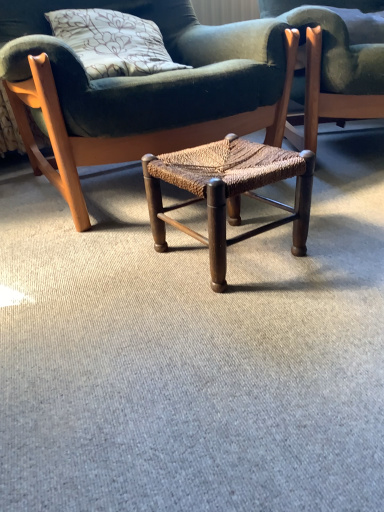
Question: From the image's perspective, is velvet floral pillow at upper left over woven wood stool at center, the second chair from the right?

Choices:
 (A) yes
 (B) no

Answer: (A)

Question: Is the depth of velvet floral pillow at upper left less than that of woven wood stool at center, the second chair from the right?

Choices:
 (A) no
 (B) yes

Answer: (A)

Question: Does velvet floral pillow at upper left touch woven wood stool at center, the first chair viewed from the left?

Choices:
 (A) yes
 (B) no

Answer: (B)

Question: Does velvet floral pillow at upper left appear on the left side of woven wood stool at center, the second chair from the right?

Choices:
 (A) no
 (B) yes

Answer: (B)

Question: Does velvet floral pillow at upper left have a greater width compared to woven wood stool at center, the second chair from the right?

Choices:
 (A) yes
 (B) no

Answer: (B)

Question: Is velvet floral pillow at upper left positioned behind woven wood stool at center, the first chair viewed from the left?

Choices:
 (A) no
 (B) yes

Answer: (B)

Question: Can you confirm if woven wood stool at center, the first chair viewed from the left, is shorter than woven wood chair at center, marked as the second chair in a left-to-right arrangement?

Choices:
 (A) yes
 (B) no

Answer: (B)

Question: Is woven wood stool at center, the second chair from the right, to the left of woven wood chair at center, marked as the second chair in a left-to-right arrangement, from the viewer's perspective?

Choices:
 (A) yes
 (B) no

Answer: (A)

Question: From a real-world perspective, is woven wood stool at center, the second chair from the right, below woven wood chair at center, arranged as the 1th chair when viewed from the right?

Choices:
 (A) no
 (B) yes

Answer: (A)

Question: Does woven wood stool at center, the first chair viewed from the left, turn towards woven wood chair at center, arranged as the 1th chair when viewed from the right?

Choices:
 (A) no
 (B) yes

Answer: (A)

Question: From the image's perspective, is woven wood stool at center, the second chair from the right, below woven wood chair at center, marked as the second chair in a left-to-right arrangement?

Choices:
 (A) yes
 (B) no

Answer: (A)

Question: Considering the relative sizes of woven wood stool at center, the second chair from the right, and woven wood chair at center, arranged as the 1th chair when viewed from the right, in the image provided, is woven wood stool at center, the second chair from the right, taller than woven wood chair at center, arranged as the 1th chair when viewed from the right,?

Choices:
 (A) yes
 (B) no

Answer: (A)

Question: Is woven wood chair at center, marked as the second chair in a left-to-right arrangement, not within woven wood stool at center?

Choices:
 (A) yes
 (B) no

Answer: (A)